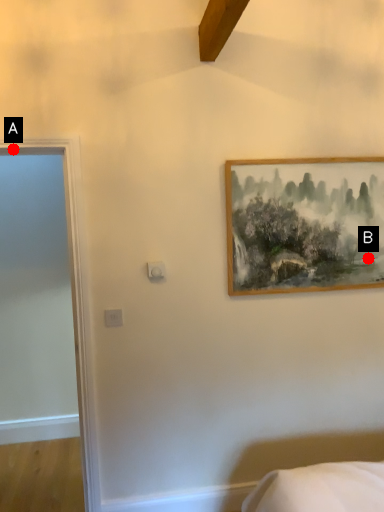
Question: Two points are circled on the image, labeled by A and B beside each circle. Which point appears closest to the camera in this image?

Choices:
 (A) A is closer
 (B) B is closer

Answer: (A)